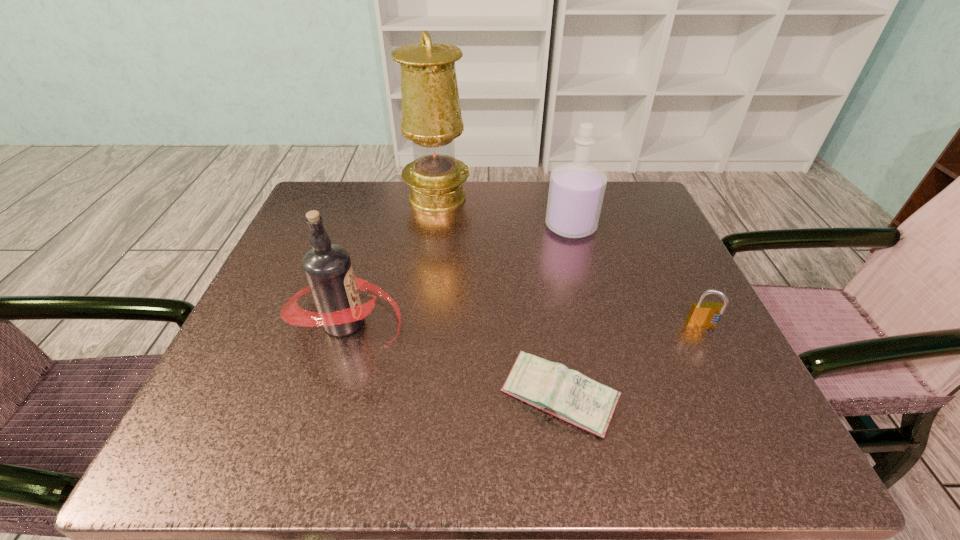
At what (x,y) coordinates should I click in order to perform the action: click on vacant area situated 0.110m on the left of the diary. Please return your answer as a coordinate pair (x, y). The width and height of the screenshot is (960, 540). Looking at the image, I should click on (427, 397).

At what (x,y) coordinates should I click in order to perform the action: click on oil lamp present at the far edge. Please return your answer as a coordinate pair (x, y). This screenshot has width=960, height=540. Looking at the image, I should click on pyautogui.click(x=431, y=115).

This screenshot has height=540, width=960. Identify the location of perfume that is at the far edge. (576, 191).

Find the location of a particular element. Image resolution: width=960 pixels, height=540 pixels. object that is positioned at the near edge is located at coordinates (552, 387).

Find the location of `object located at the left edge`. object located at the left edge is located at coordinates (327, 267).

At what (x,y) coordinates should I click in order to perform the action: click on perfume present at the right edge. Please return your answer as a coordinate pair (x, y). This screenshot has width=960, height=540. Looking at the image, I should click on (576, 191).

Find the location of `padlock present at the right edge`. padlock present at the right edge is located at coordinates (701, 314).

Image resolution: width=960 pixels, height=540 pixels. I want to click on object present at the far right corner, so click(576, 191).

The width and height of the screenshot is (960, 540). I want to click on blank space at the far edge of the desktop, so click(x=510, y=204).

Identify the location of vacant space at the near edge. This screenshot has height=540, width=960. (450, 451).